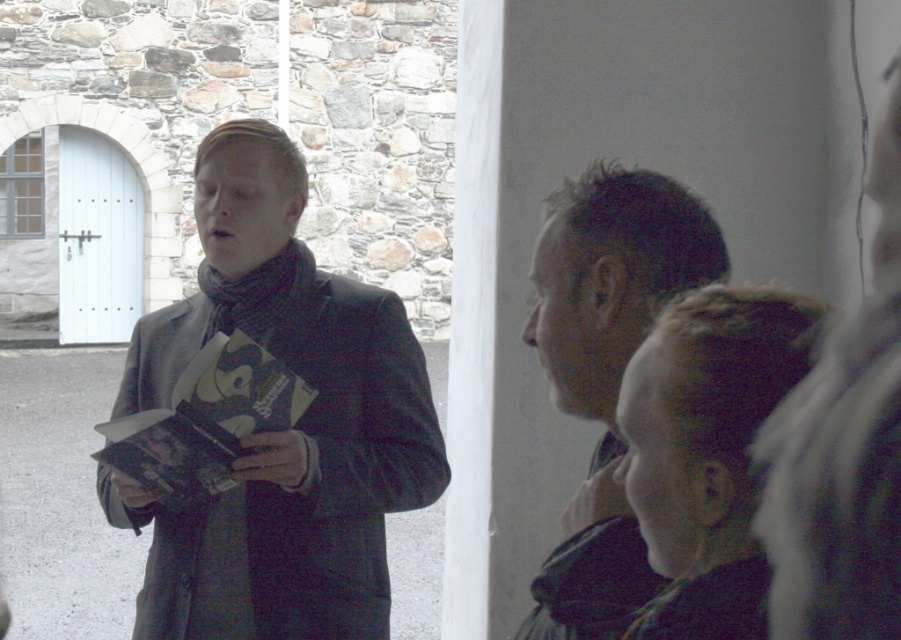
Is matte black jacket at left further to camera compared to velvet-like brown robe at lower right?

That is True.

Based on the photo, can you confirm if matte black jacket at left is shorter than velvet-like brown robe at lower right?

Indeed, matte black jacket at left has a lesser height compared to velvet-like brown robe at lower right.

Image resolution: width=901 pixels, height=640 pixels. What do you see at coordinates (281, 429) in the screenshot?
I see `matte black jacket at left` at bounding box center [281, 429].

Find the location of a particular element. The height and width of the screenshot is (640, 901). matte black jacket at left is located at coordinates (281, 429).

Is matte black jacket at left below dark brown hair at center?

Indeed, matte black jacket at left is positioned under dark brown hair at center.

Does point (350, 372) come farther from viewer compared to point (601, 616)?

Yes, point (350, 372) is farther from viewer.

Looking at this image, who is more distant from viewer, (359, 609) or (594, 264)?

The point (359, 609) is more distant.

Where is `matte black jacket at left`? The image size is (901, 640). matte black jacket at left is located at coordinates (281, 429).

Consider the image. Is dark brown hair at center positioned behind velvet-like brown robe at lower right?

Yes, it is.

Who is positioned more to the left, dark brown hair at center or velvet-like brown robe at lower right?

From the viewer's perspective, velvet-like brown robe at lower right appears more on the left side.

Measure the distance between dark brown hair at center and camera.

Result: dark brown hair at center and camera are 31.95 feet apart from each other.

Where is `dark brown hair at center`? dark brown hair at center is located at coordinates (606, 369).